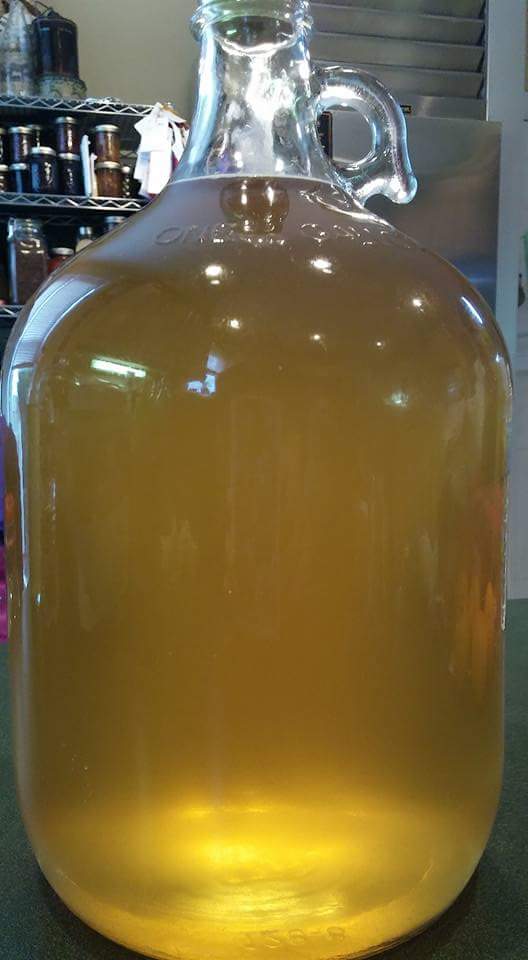
At what (x,y) coordinates should I click in order to perform the action: click on table. Please return your answer as a coordinate pair (x, y). The image size is (528, 960). Looking at the image, I should click on (301, 947), (495, 923).